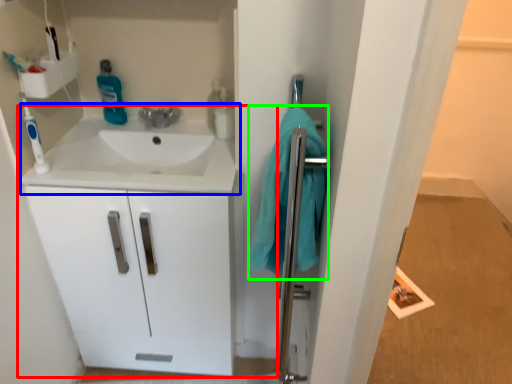
Question: Based on their relative distances, which object is farther from bathroom cabinet (highlighted by a red box)? Choose from sink (highlighted by a blue box) and bath towel (highlighted by a green box).

Choices:
 (A) sink
 (B) bath towel

Answer: (B)